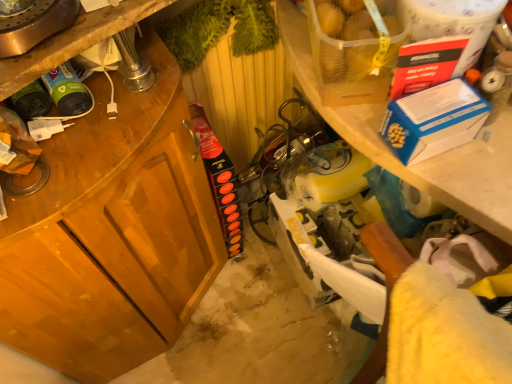
Image resolution: width=512 pixels, height=384 pixels. What do you see at coordinates (112, 234) in the screenshot? I see `wooden cabinet at left` at bounding box center [112, 234].

What are the coordinates of `white plastic shelf at upper right` in the screenshot? It's located at (424, 160).

Can you tell me how much wooden cabinet at left and blue cardboard box at upper right differ in facing direction?

They differ by 3.19 degrees in their facing directions.

Is blue cardboard box at upper right at the back of wooden cabinet at left?

No, wooden cabinet at left is not facing away from blue cardboard box at upper right.

From the image's perspective, is wooden cabinet at left located above or below blue cardboard box at upper right?

wooden cabinet at left is below blue cardboard box at upper right.

Which is in front, wooden cabinet at left or blue cardboard box at upper right?

wooden cabinet at left.

Is blue cardboard box at upper right bigger than wooden cabinet at left?

Incorrect, blue cardboard box at upper right is not larger than wooden cabinet at left.

Is wooden cabinet at left at the back of blue cardboard box at upper right?

No, blue cardboard box at upper right's orientation is not away from wooden cabinet at left.

From the image's perspective, which one is positioned higher, blue cardboard box at upper right or wooden cabinet at left?

blue cardboard box at upper right appears higher in the image.

Is blue cardboard box at upper right far from wooden cabinet at left?

No.

Is white plastic shelf at upper right surrounding translucent plastic bag of potatoes at upper right?

That's incorrect, translucent plastic bag of potatoes at upper right is not inside white plastic shelf at upper right.

Looking at this image, from a real-world perspective, which is physically above, white plastic shelf at upper right or translucent plastic bag of potatoes at upper right?

translucent plastic bag of potatoes at upper right, from a real-world perspective.

Who is smaller, white plastic shelf at upper right or translucent plastic bag of potatoes at upper right?

With smaller size is translucent plastic bag of potatoes at upper right.

From the picture: Considering the relative sizes of white plastic shelf at upper right and translucent plastic bag of potatoes at upper right in the image provided, is white plastic shelf at upper right taller than translucent plastic bag of potatoes at upper right?

Correct, white plastic shelf at upper right is much taller as translucent plastic bag of potatoes at upper right.

Is blue cardboard box at upper right positioned in front of translucent plastic bag of potatoes at upper right?

No, it is not.

Between blue cardboard box at upper right and translucent plastic bag of potatoes at upper right, which one appears on the right side from the viewer's perspective?

Positioned to the right is blue cardboard box at upper right.

How different are the orientations of blue cardboard box at upper right and translucent plastic bag of potatoes at upper right in degrees?

The facing directions of blue cardboard box at upper right and translucent plastic bag of potatoes at upper right are 26.2 degrees apart.

Consider the image. Is blue cardboard box at upper right touching translucent plastic bag of potatoes at upper right?

No.

Considering the sizes of objects translucent plastic bag of potatoes at upper right and white plastic shelf at upper right in the image provided, who is thinner, translucent plastic bag of potatoes at upper right or white plastic shelf at upper right?

With smaller width is translucent plastic bag of potatoes at upper right.

Is translucent plastic bag of potatoes at upper right positioned behind white plastic shelf at upper right?

No, it is not.

Is the surface of translucent plastic bag of potatoes at upper right in direct contact with white plastic shelf at upper right?

No, translucent plastic bag of potatoes at upper right is not touching white plastic shelf at upper right.

Is white plastic shelf at upper right at the back of translucent plastic bag of potatoes at upper right?

No, translucent plastic bag of potatoes at upper right's orientation is not away from white plastic shelf at upper right.

Which is more to the left, white plastic shelf at upper right or blue cardboard box at upper right?

white plastic shelf at upper right is more to the left.

Is white plastic shelf at upper right oriented away from blue cardboard box at upper right?

No, blue cardboard box at upper right is not at the back of white plastic shelf at upper right.

Is white plastic shelf at upper right wider or thinner than blue cardboard box at upper right?

white plastic shelf at upper right is wider than blue cardboard box at upper right.

From a real-world perspective, relative to blue cardboard box at upper right, is white plastic shelf at upper right vertically above or below?

In terms of real-world spatial position, white plastic shelf at upper right is below blue cardboard box at upper right.

Is wooden cabinet at left in front of or behind white plastic shelf at upper right in the image?

wooden cabinet at left is positioned closer to the viewer than white plastic shelf at upper right.

Is wooden cabinet at left spatially inside white plastic shelf at upper right, or outside of it?

wooden cabinet at left cannot be found inside white plastic shelf at upper right.

Does wooden cabinet at left have a larger size compared to white plastic shelf at upper right?

Actually, wooden cabinet at left might be smaller than white plastic shelf at upper right.

From a real-world perspective, is wooden cabinet at left over white plastic shelf at upper right?

Incorrect, from a real-world perspective, wooden cabinet at left is lower than white plastic shelf at upper right.

This screenshot has width=512, height=384. I want to click on box behind the wooden cabinet at left, so click(433, 120).

Locate an element on the screen. This screenshot has width=512, height=384. cabinetry in front of the blue cardboard box at upper right is located at coordinates (112, 234).

Estimate the real-world distances between objects in this image. Which object is closer to blue cardboard box at upper right, translucent plastic bag of potatoes at upper right or wooden cabinet at left?

translucent plastic bag of potatoes at upper right is closer to blue cardboard box at upper right.

Based on the photo, considering their positions, is translucent plastic bag of potatoes at upper right positioned further to white plastic shelf at upper right than wooden cabinet at left?

wooden cabinet at left.

Which object lies nearer to the anchor point wooden cabinet at left, white plastic shelf at upper right or blue cardboard box at upper right?

Among the two, white plastic shelf at upper right is located nearer to wooden cabinet at left.

Which object lies nearer to the anchor point wooden cabinet at left, blue cardboard box at upper right or translucent plastic bag of potatoes at upper right?

translucent plastic bag of potatoes at upper right is positioned closer to the anchor wooden cabinet at left.

From the image, which object appears to be farther from blue cardboard box at upper right, white plastic shelf at upper right or translucent plastic bag of potatoes at upper right?

translucent plastic bag of potatoes at upper right is further to blue cardboard box at upper right.

When comparing their distances from wooden cabinet at left, does blue cardboard box at upper right or white plastic shelf at upper right seem further?

Based on the image, blue cardboard box at upper right appears to be further to wooden cabinet at left.

Looking at the image, which one is located closer to blue cardboard box at upper right, white plastic shelf at upper right or wooden cabinet at left?

white plastic shelf at upper right is positioned closer to the anchor blue cardboard box at upper right.

Looking at this image, considering their positions, is wooden cabinet at left positioned closer to white plastic shelf at upper right than blue cardboard box at upper right?

blue cardboard box at upper right.

What are the coordinates of `box between translucent plastic bag of potatoes at upper right and white plastic shelf at upper right from top to bottom` in the screenshot? It's located at (433, 120).

The width and height of the screenshot is (512, 384). I want to click on food situated between wooden cabinet at left and blue cardboard box at upper right from left to right, so (355, 41).

Identify the location of shelf situated between wooden cabinet at left and blue cardboard box at upper right from left to right. (424, 160).

The width and height of the screenshot is (512, 384). I want to click on food between wooden cabinet at left and white plastic shelf at upper right in the horizontal direction, so click(355, 41).